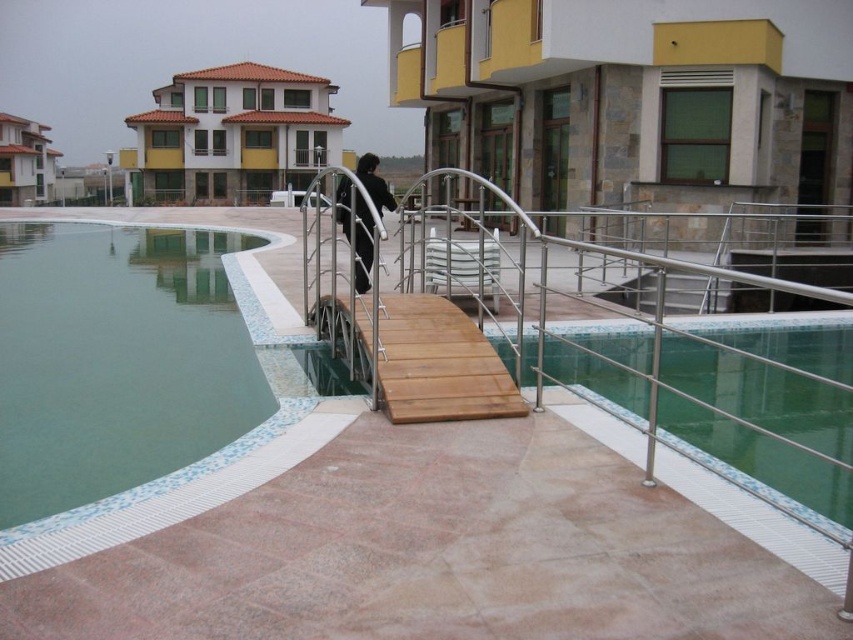
You are standing at the edge of the pool and see the smooth tile swimming pool at center and the black matte clothing at center. Which object is closer to the water surface?

The smooth tile swimming pool at center is located below the black matte clothing at center, so the smooth tile swimming pool at center is closer to the water surface.